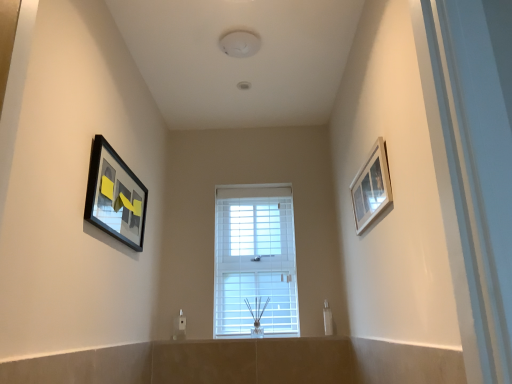
This screenshot has height=384, width=512. Describe the element at coordinates (115, 196) in the screenshot. I see `matte black picture frame at left, the 1th picture frame viewed from the left` at that location.

What is the approximate width of white matte window at center?

The width of white matte window at center is 17.00 centimeters.

Locate an element on the screen. The image size is (512, 384). matte black picture frame at left, the second picture frame from the right is located at coordinates (115, 196).

From the picture: From the image's perspective, does white matte window at center appear higher than matte black picture frame at left, the 1th picture frame viewed from the left?

No, from the image's perspective, white matte window at center is not on top of matte black picture frame at left, the 1th picture frame viewed from the left.

In terms of width, does white matte window at center look wider or thinner when compared to matte black picture frame at left, the second picture frame from the right?

Considering their sizes, white matte window at center looks broader than matte black picture frame at left, the second picture frame from the right.

I want to click on window below the matte black picture frame at left, the second picture frame from the right (from the image's perspective), so click(x=255, y=261).

Is white matte window at center facing away from matte black picture frame at left, the second picture frame from the right?

That's not correct — white matte window at center is not looking away from matte black picture frame at left, the second picture frame from the right.

Which of these two, white matte window at center or white glossy picture frame at upper right, marked as the 1th picture frame in a right-to-left arrangement, is wider?

white matte window at center is wider.

Is white matte window at center turned away from white glossy picture frame at upper right, the second picture frame when ordered from left to right?

That's not correct — white matte window at center is not looking away from white glossy picture frame at upper right, the second picture frame when ordered from left to right.

Is white matte window at center located outside white glossy picture frame at upper right, marked as the 1th picture frame in a right-to-left arrangement?

Indeed, white matte window at center is completely outside white glossy picture frame at upper right, marked as the 1th picture frame in a right-to-left arrangement.

Which object is more forward, white matte window at center or white glossy picture frame at upper right, the second picture frame when ordered from left to right?

white glossy picture frame at upper right, the second picture frame when ordered from left to right, is in front.

Considering the relative sizes of white glossy picture frame at upper right, the second picture frame when ordered from left to right, and matte black picture frame at left, the second picture frame from the right, in the image provided, is white glossy picture frame at upper right, the second picture frame when ordered from left to right, wider than matte black picture frame at left, the second picture frame from the right,?

In fact, white glossy picture frame at upper right, the second picture frame when ordered from left to right, might be narrower than matte black picture frame at left, the second picture frame from the right.

The width and height of the screenshot is (512, 384). Identify the location of picture frame above the matte black picture frame at left, the second picture frame from the right (from the image's perspective). (371, 187).

Between point (381, 155) and point (131, 200), which one is positioned in front?

The point (381, 155) is in front.

How different are the orientations of matte black picture frame at left, the second picture frame from the right, and white glossy picture frame at upper right, the second picture frame when ordered from left to right, in degrees?

matte black picture frame at left, the second picture frame from the right, and white glossy picture frame at upper right, the second picture frame when ordered from left to right, are facing 179 degrees away from each other.

Does point (122, 170) appear closer or farther from the camera than point (391, 198)?

Point (122, 170).

In the image, is matte black picture frame at left, the 1th picture frame viewed from the left, positioned in front of or behind white glossy picture frame at upper right, marked as the 1th picture frame in a right-to-left arrangement?

matte black picture frame at left, the 1th picture frame viewed from the left, is positioned farther from the viewer than white glossy picture frame at upper right, marked as the 1th picture frame in a right-to-left arrangement.

Is white glossy picture frame at upper right, the second picture frame when ordered from left to right, at the back of matte black picture frame at left, the 1th picture frame viewed from the left?

matte black picture frame at left, the 1th picture frame viewed from the left, does not have its back to white glossy picture frame at upper right, the second picture frame when ordered from left to right.

Does matte black picture frame at left, the 1th picture frame viewed from the left, have a smaller size compared to white matte window at center?

Indeed, matte black picture frame at left, the 1th picture frame viewed from the left, has a smaller size compared to white matte window at center.

This screenshot has height=384, width=512. In order to click on picture frame located on the left of white matte window at center in this screenshot , I will do `click(115, 196)`.

Considering the sizes of objects matte black picture frame at left, the second picture frame from the right, and white matte window at center in the image provided, who is shorter, matte black picture frame at left, the second picture frame from the right, or white matte window at center?

matte black picture frame at left, the second picture frame from the right, is shorter.

Does point (106, 149) come closer to viewer compared to point (254, 308)?

Yes, it is in front of point (254, 308).

Which is correct: white glossy picture frame at upper right, marked as the 1th picture frame in a right-to-left arrangement, is inside white matte window at center, or outside of it?

white glossy picture frame at upper right, marked as the 1th picture frame in a right-to-left arrangement, cannot be found inside white matte window at center.

Is white glossy picture frame at upper right, the second picture frame when ordered from left to right, taller than white matte window at center?

In fact, white glossy picture frame at upper right, the second picture frame when ordered from left to right, may be shorter than white matte window at center.

From a real-world perspective, is white glossy picture frame at upper right, the second picture frame when ordered from left to right, physically below white matte window at center?

No.

Identify the location of picture frame on the left of white matte window at center. Image resolution: width=512 pixels, height=384 pixels. (115, 196).

Where is `window that appears below the white glossy picture frame at upper right, marked as the 1th picture frame in a right-to-left arrangement (from the image's perspective)`? Image resolution: width=512 pixels, height=384 pixels. window that appears below the white glossy picture frame at upper right, marked as the 1th picture frame in a right-to-left arrangement (from the image's perspective) is located at coordinates (255, 261).

Looking at the image, which one is located closer to white glossy picture frame at upper right, the second picture frame when ordered from left to right, white matte window at center or matte black picture frame at left, the second picture frame from the right?

The object closer to white glossy picture frame at upper right, the second picture frame when ordered from left to right, is white matte window at center.

Which object lies further to the anchor point white glossy picture frame at upper right, marked as the 1th picture frame in a right-to-left arrangement, matte black picture frame at left, the 1th picture frame viewed from the left, or white matte window at center?

The object further to white glossy picture frame at upper right, marked as the 1th picture frame in a right-to-left arrangement, is matte black picture frame at left, the 1th picture frame viewed from the left.

Looking at the image, which one is located further to white matte window at center, white glossy picture frame at upper right, the second picture frame when ordered from left to right, or matte black picture frame at left, the 1th picture frame viewed from the left?

matte black picture frame at left, the 1th picture frame viewed from the left, lies further to white matte window at center than the other object.

When comparing their distances from matte black picture frame at left, the second picture frame from the right, does white glossy picture frame at upper right, the second picture frame when ordered from left to right, or white matte window at center seem further?

Based on the image, white glossy picture frame at upper right, the second picture frame when ordered from left to right, appears to be further to matte black picture frame at left, the second picture frame from the right.

Estimate the real-world distances between objects in this image. Which object is closer to matte black picture frame at left, the second picture frame from the right, white matte window at center or white glossy picture frame at upper right, the second picture frame when ordered from left to right?

white matte window at center is positioned closer to the anchor matte black picture frame at left, the second picture frame from the right.

Considering their positions, is matte black picture frame at left, the second picture frame from the right, positioned further to white matte window at center than white glossy picture frame at upper right, the second picture frame when ordered from left to right?

The object further to white matte window at center is matte black picture frame at left, the second picture frame from the right.

Image resolution: width=512 pixels, height=384 pixels. Find the location of `picture frame between white glossy picture frame at upper right, the second picture frame when ordered from left to right, and white matte window at center from front to back`. picture frame between white glossy picture frame at upper right, the second picture frame when ordered from left to right, and white matte window at center from front to back is located at coordinates (115, 196).